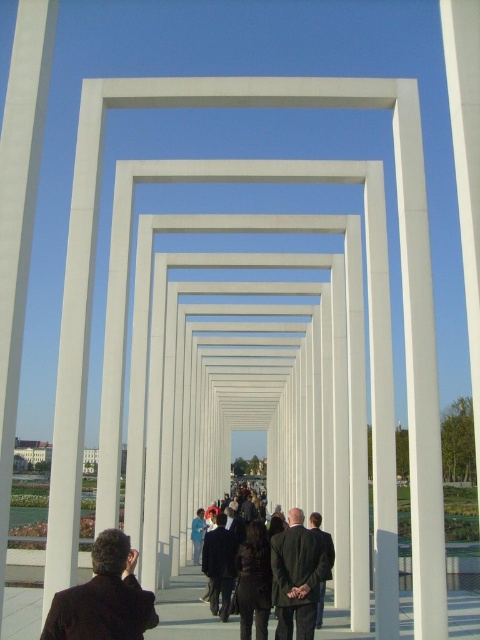
From the picture: You are a photographer standing at the entrance of the white rectangular frames tunnel. You notice two people wearing dark brown suit at center and dark suit at center walking towards the horizon. Which person would appear smaller to you as they move further into the tunnel?

The dark suit at center would appear smaller than the dark brown suit at center as they move further into the tunnel because the dark brown suit at center is larger in size.

Based on the photo, you are organizing a photo shoot in this architectural structure. You need to place two models wearing dark suit at center and dark gray suit at center. Which model should you choose to fit into a narrower space if you want them to stand side by side without overlapping?

The dark suit at center has a lesser width compared to the dark gray suit at center, so you should choose the model wearing the dark suit at center to fit into the narrower space.

You are standing at the entrance of the architectural structure and see a point marked at coordinates point (299, 573). Which object in the scene is this point located on?

The point (299, 573) is located on the dark suit at center.